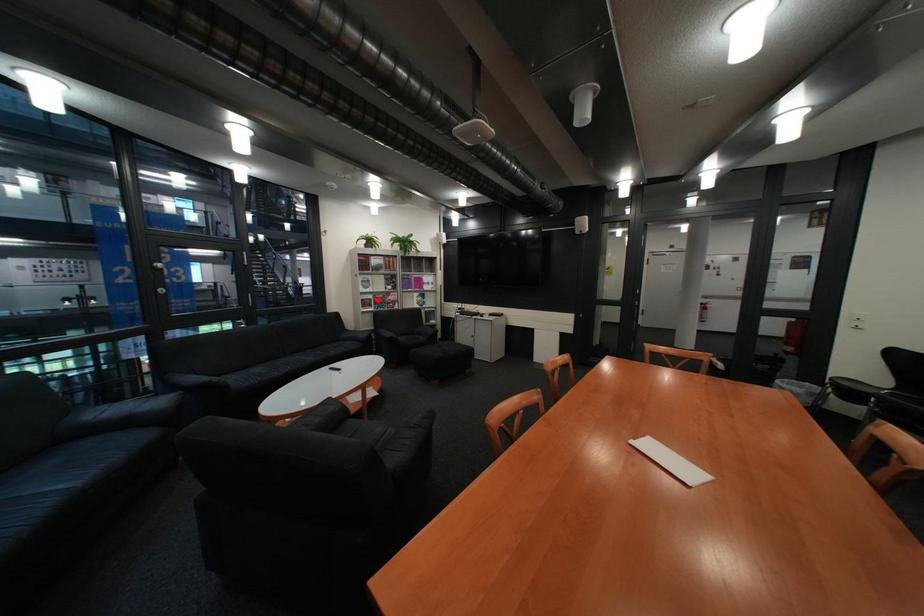
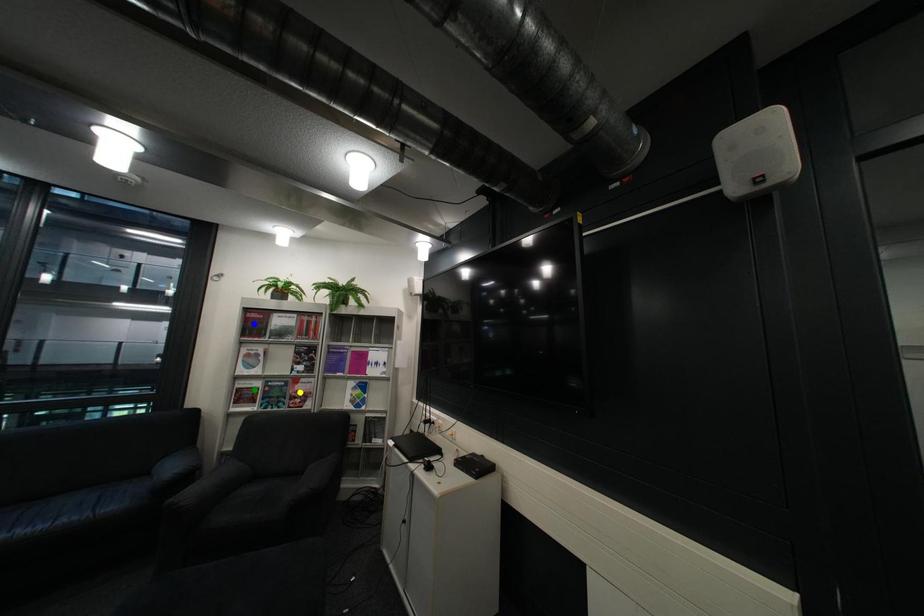
Question: I am providing you with two images of the same scene from different viewpoints. A red point is marked on the first image. You are given multiple points on the second image. Can you choose the point in image 2 that corresponds to the point in image 1?

Choices:
 (A) green point
 (B) yellow point
 (C) blue point

Answer: (A)